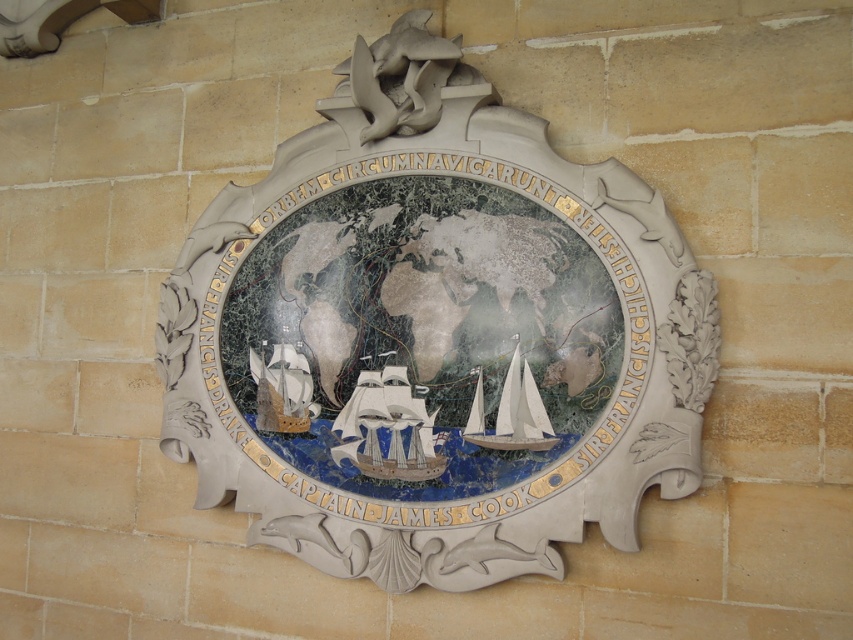
Question: Which of the following is the closest to the observer?

Choices:
 (A) white glossy sailboat at center
 (B) white paper boat at lower left

Answer: (A)

Question: Does blue glossy ship at center have a smaller size compared to white paper boat at lower left?

Choices:
 (A) yes
 (B) no

Answer: (B)

Question: Estimate the real-world distances between objects in this image. Which object is farther from the white paper boat at lower left?

Choices:
 (A) white glossy sailboat at center
 (B) blue glossy ship at center

Answer: (A)

Question: Which object is farther from the camera taking this photo?

Choices:
 (A) white paper boat at lower left
 (B) white glossy sailboat at center
 (C) blue glossy ship at center

Answer: (A)

Question: Where is blue glossy ship at center located in relation to white glossy sailboat at center in the image?

Choices:
 (A) left
 (B) right

Answer: (A)

Question: In this image, where is marble relief map at center located relative to white paper boat at lower left?

Choices:
 (A) below
 (B) above

Answer: (B)